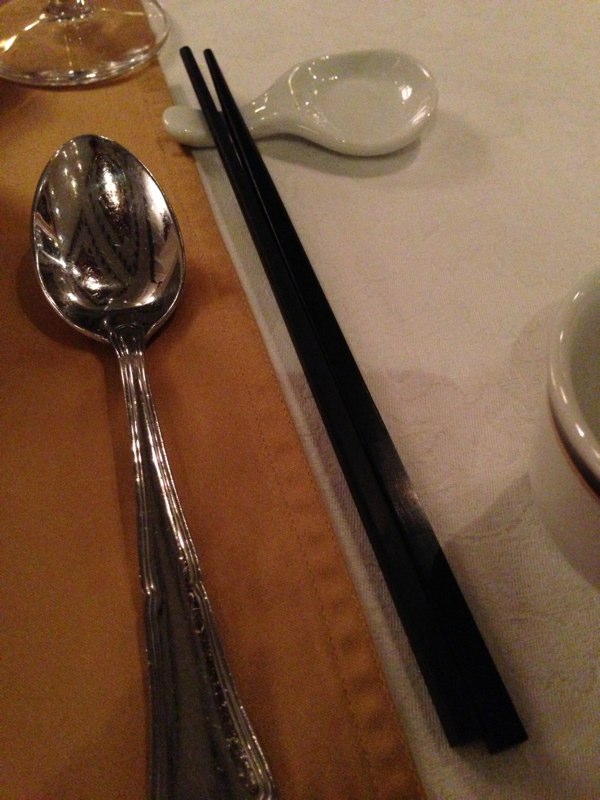
I want to click on napkin, so click(x=284, y=554).